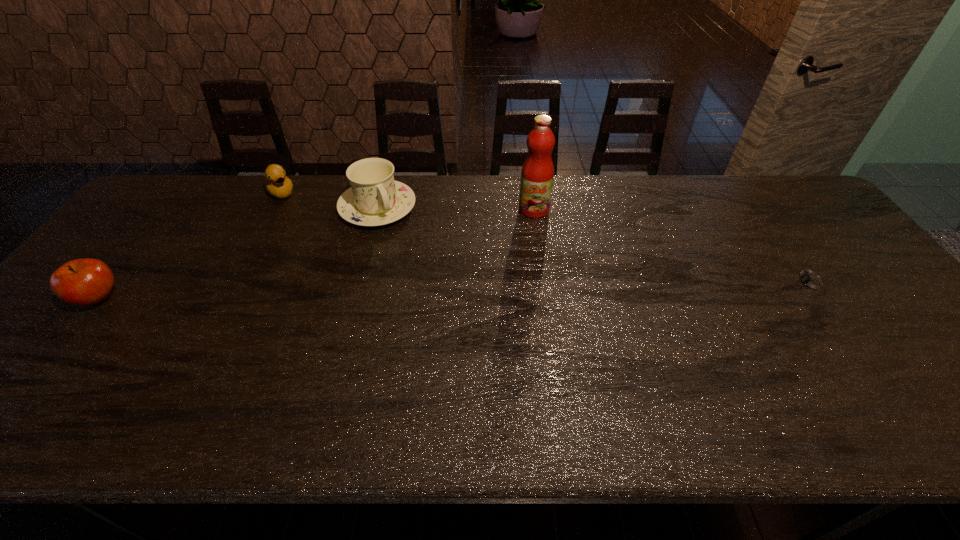
Locate an element on the screen. free space on the desktop that is between the apple and the shortest object and is positioned on the front label of the second object from right to left is located at coordinates (502, 290).

Find the location of a particular element. The image size is (960, 540). vacant space on the desktop that is between the leftmost object and the shortest object and is positioned on the handle side of the chinaware is located at coordinates (438, 292).

What are the coordinates of `vacant space on the desktop that is between the apple and the shortest object and is positioned facing forward on the second object from left to right` in the screenshot? It's located at (361, 293).